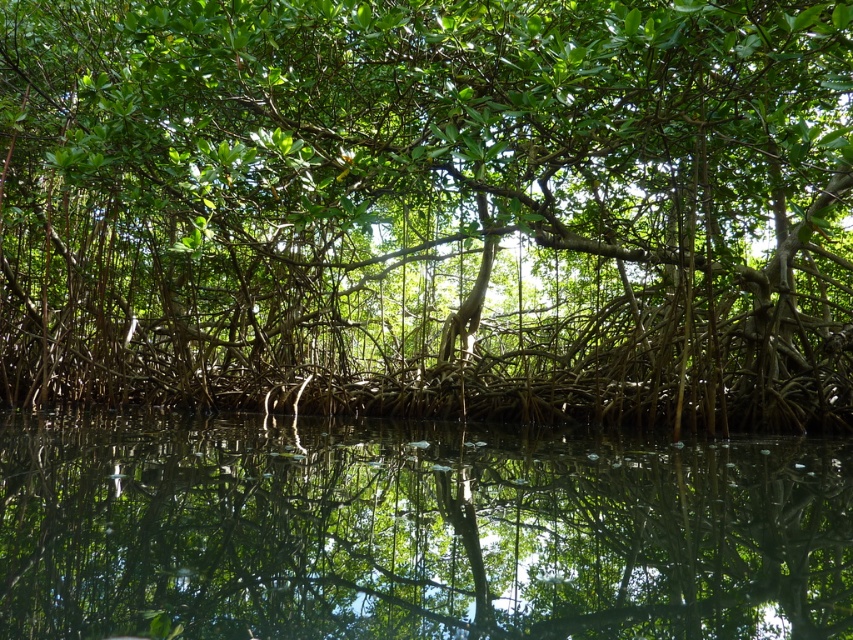
Question: Is green leafy tree at center positioned behind transparent water at center?

Choices:
 (A) no
 (B) yes

Answer: (B)

Question: Is green leafy tree at center further to camera compared to transparent water at center?

Choices:
 (A) yes
 (B) no

Answer: (A)

Question: Which object is farther from the camera taking this photo?

Choices:
 (A) transparent water at center
 (B) green leafy tree at center

Answer: (B)

Question: Does green leafy tree at center have a smaller size compared to transparent water at center?

Choices:
 (A) no
 (B) yes

Answer: (A)